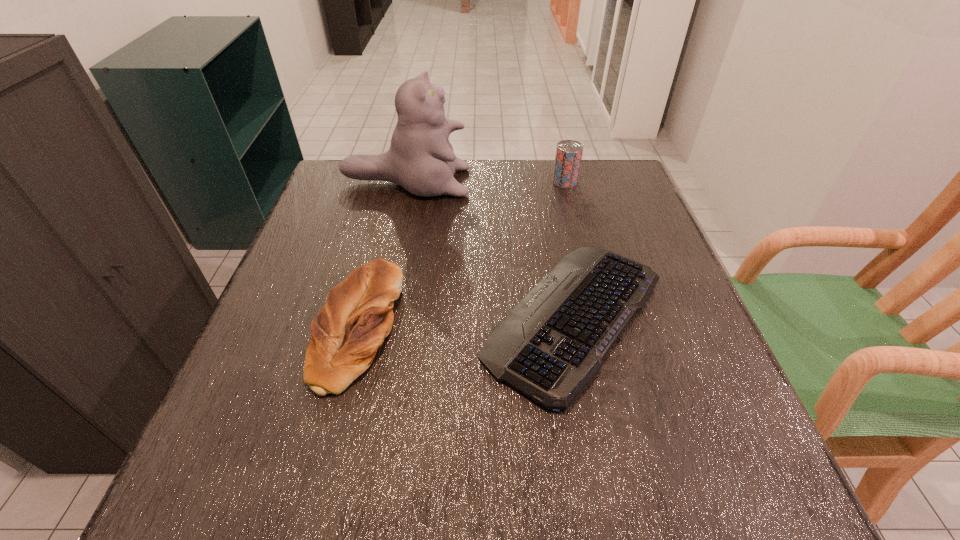
You are a GUI agent. You are given a task and a screenshot of the screen. Output one action in this format:
    pyautogui.click(x=<x>, y=<y>)
    Task: Click on the cat
    The width and height of the screenshot is (960, 540).
    Given the screenshot: What is the action you would take?
    pyautogui.click(x=421, y=159)

Locate an element on the screen. the second tallest object is located at coordinates (568, 156).

What are the coordinates of `bread` in the screenshot? It's located at (358, 315).

The width and height of the screenshot is (960, 540). Find the location of `the shortest object`. the shortest object is located at coordinates point(551,344).

Identify the location of vacant area situated 0.150m on the face of the tallest object. This screenshot has height=540, width=960. (524, 182).

Locate an element on the screen. free space located 0.230m on the front of the third shortest object is located at coordinates (581, 244).

Image resolution: width=960 pixels, height=540 pixels. Find the location of `vacant space located on the right of the third tallest object`. vacant space located on the right of the third tallest object is located at coordinates (503, 327).

Locate an element on the screen. This screenshot has width=960, height=540. free space located on the back of the shortest object is located at coordinates (544, 167).

Find the location of a particular element. This screenshot has width=960, height=540. cat that is at the far edge is located at coordinates (421, 159).

Locate an element on the screen. The height and width of the screenshot is (540, 960). beer can that is at the far edge is located at coordinates (568, 156).